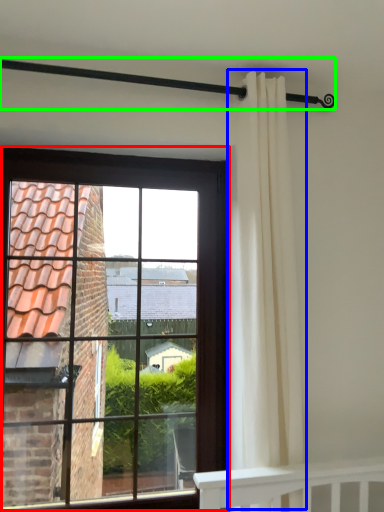
Question: Which object is the closest to the window (highlighted by a red box)? Choose among these: curtain (highlighted by a blue box) or balustrade (highlighted by a green box).

Choices:
 (A) curtain
 (B) balustrade

Answer: (A)